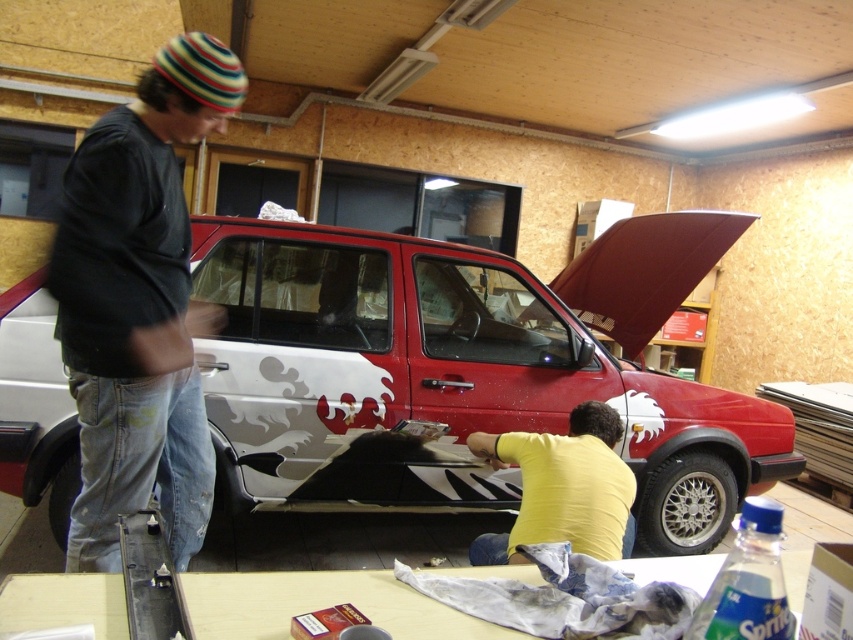
You are standing in front of the car in the workshop and want to know which of the two points, point (x=440, y=372) or point (x=560, y=440), is closer to you. Can you determine this based on their positions?

Point (x=440, y=372) is further to the camera than point (x=560, y=440), so the point closer to you is point (x=560, y=440).